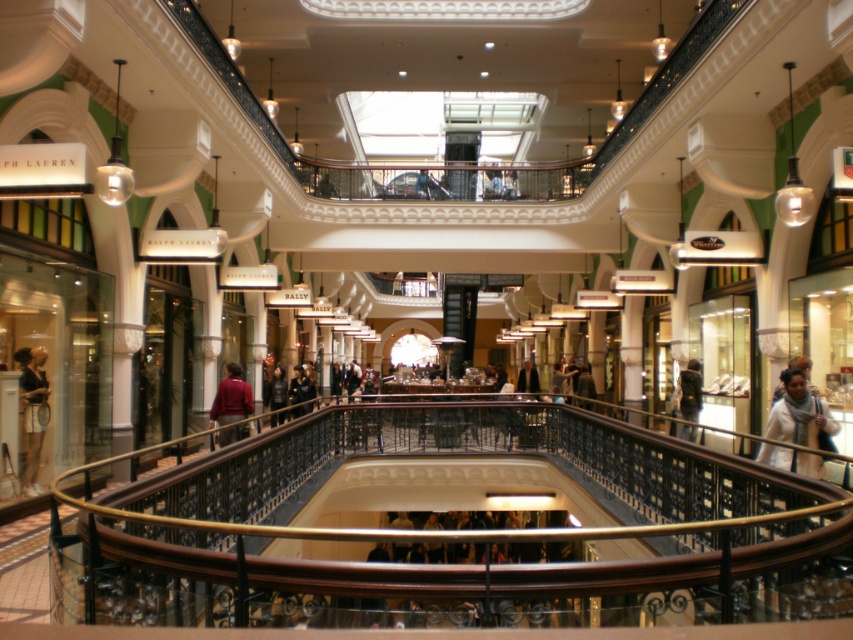
Question: Which point is farther from the camera taking this photo?

Choices:
 (A) (625, 460)
 (B) (532, 388)
 (C) (231, 406)
 (D) (33, 461)

Answer: (B)

Question: Among these points, which one is nearest to the camera?

Choices:
 (A) (527, 387)
 (B) (32, 419)

Answer: (B)

Question: Where is white fabric bag at lower right located in relation to maroon fabric jacket at center in the image?

Choices:
 (A) below
 (B) above

Answer: (B)

Question: Which object appears closest to the camera in this image?

Choices:
 (A) dark gray fabric at center
 (B) maroon fabric jacket at center

Answer: (A)

Question: Is dark brown leather jacket at center positioned behind dark gray sweater at center?

Choices:
 (A) yes
 (B) no

Answer: (B)

Question: From the image, what is the correct spatial relationship of wooden at center in relation to dark gray fabric at center?

Choices:
 (A) below
 (B) above

Answer: (B)